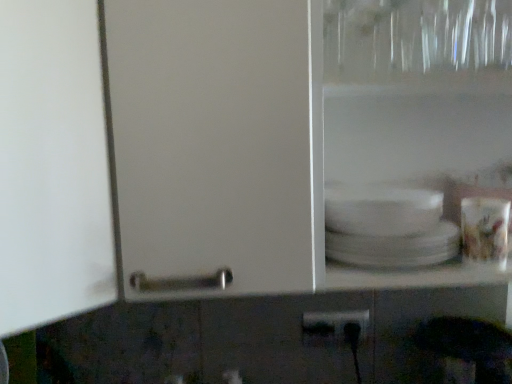
Describe the element at coordinates (335, 327) in the screenshot. Image resolution: width=512 pixels, height=384 pixels. I see `black plastic power plugs and sockets at lower center` at that location.

The image size is (512, 384). I want to click on black plastic power plugs and sockets at lower center, so click(335, 327).

In order to face black plastic power plugs and sockets at lower center, should I rotate leftwards or rightwards?

It's best to rotate right around 11.040 degrees.

What is the approximate height of matte ceramic cup at right?

matte ceramic cup at right is 4.34 inches tall.

What do you see at coordinates (485, 231) in the screenshot? I see `matte ceramic cup at right` at bounding box center [485, 231].

This screenshot has width=512, height=384. Identify the location of matte ceramic cup at right. (485, 231).

At what (x,y) coordinates should I click in order to perform the action: click on black plastic power plugs and sockets at lower center. Please return your answer as a coordinate pair (x, y). This screenshot has width=512, height=384. Looking at the image, I should click on (335, 327).

Considering the relative positions of black plastic power plugs and sockets at lower center and matte ceramic cup at right in the image provided, is black plastic power plugs and sockets at lower center to the right of matte ceramic cup at right from the viewer's perspective?

No, black plastic power plugs and sockets at lower center is not to the right of matte ceramic cup at right.

In the image, is black plastic power plugs and sockets at lower center positioned in front of or behind matte ceramic cup at right?

black plastic power plugs and sockets at lower center is behind matte ceramic cup at right.

Which is behind, point (311, 327) or point (490, 246)?

The point (311, 327) is more distant.

From the image's perspective, which is below, black plastic power plugs and sockets at lower center or matte ceramic cup at right?

black plastic power plugs and sockets at lower center is shown below in the image.

From a real-world perspective, which object stands above the other?

matte ceramic cup at right is physically above.

Which of these two, black plastic power plugs and sockets at lower center or matte ceramic cup at right, is wider?

matte ceramic cup at right is wider.

Can you confirm if black plastic power plugs and sockets at lower center is shorter than matte ceramic cup at right?

Indeed, black plastic power plugs and sockets at lower center has a lesser height compared to matte ceramic cup at right.

Which of these two, black plastic power plugs and sockets at lower center or matte ceramic cup at right, is smaller?

black plastic power plugs and sockets at lower center.

Can matte ceramic cup at right be found inside black plastic power plugs and sockets at lower center?

That's incorrect, matte ceramic cup at right is not inside black plastic power plugs and sockets at lower center.

Looking at this image, is there a large distance between black plastic power plugs and sockets at lower center and matte ceramic cup at right?

No, there isn't a large distance between black plastic power plugs and sockets at lower center and matte ceramic cup at right.

From the picture: Is black plastic power plugs and sockets at lower center facing away from matte ceramic cup at right?

That's not correct — black plastic power plugs and sockets at lower center is not looking away from matte ceramic cup at right.

What's the angular difference between black plastic power plugs and sockets at lower center and matte ceramic cup at right's facing directions?

The angular difference between black plastic power plugs and sockets at lower center and matte ceramic cup at right is 2 degrees.

You are a GUI agent. You are given a task and a screenshot of the screen. Output one action in this format:
    pyautogui.click(x=<x>, y=<y>)
    Task: Click on the tableware above the black plastic power plugs and sockets at lower center (from a real-world perspective)
    
    Given the screenshot: What is the action you would take?
    pyautogui.click(x=485, y=231)

Considering the positions of objects matte ceramic cup at right and black plastic power plugs and sockets at lower center in the image provided, who is more to the right, matte ceramic cup at right or black plastic power plugs and sockets at lower center?

Positioned to the right is matte ceramic cup at right.

Which object is closer to the camera, matte ceramic cup at right or black plastic power plugs and sockets at lower center?

matte ceramic cup at right is more forward.

Does point (499, 235) come farther from viewer compared to point (347, 337)?

No.

Consider the image. From the image's perspective, is matte ceramic cup at right positioned above or below black plastic power plugs and sockets at lower center?

Based on their image positions, matte ceramic cup at right is located above black plastic power plugs and sockets at lower center.

From a real-world perspective, is matte ceramic cup at right positioned above or below black plastic power plugs and sockets at lower center?

In terms of real-world spatial position, matte ceramic cup at right is above black plastic power plugs and sockets at lower center.

Between matte ceramic cup at right and black plastic power plugs and sockets at lower center, which one has larger width?

Wider between the two is matte ceramic cup at right.

Can you confirm if matte ceramic cup at right is taller than black plastic power plugs and sockets at lower center?

Yes, matte ceramic cup at right is taller than black plastic power plugs and sockets at lower center.

In the scene shown: Is matte ceramic cup at right smaller than black plastic power plugs and sockets at lower center?

Actually, matte ceramic cup at right might be larger than black plastic power plugs and sockets at lower center.

Could black plastic power plugs and sockets at lower center be considered to be inside matte ceramic cup at right?

No, black plastic power plugs and sockets at lower center is not surrounded by matte ceramic cup at right.

Is the surface of matte ceramic cup at right in direct contact with black plastic power plugs and sockets at lower center?

No, matte ceramic cup at right is not beside black plastic power plugs and sockets at lower center.

Is matte ceramic cup at right positioned with its back to black plastic power plugs and sockets at lower center?

No.

Could you measure the distance between matte ceramic cup at right and black plastic power plugs and sockets at lower center?

matte ceramic cup at right and black plastic power plugs and sockets at lower center are 14.64 inches apart.

You are a GUI agent. You are given a task and a screenshot of the screen. Output one action in this format:
    pyautogui.click(x=<x>, y=<y>)
    Task: Click on the power plugs and sockets that appears below the matte ceramic cup at right (from the image's perspective)
    
    Given the screenshot: What is the action you would take?
    pyautogui.click(x=335, y=327)

The width and height of the screenshot is (512, 384). In order to click on power plugs and sockets below the matte ceramic cup at right (from the image's perspective) in this screenshot , I will do `click(335, 327)`.

Where is `power plugs and sockets on the left of matte ceramic cup at right`? Image resolution: width=512 pixels, height=384 pixels. power plugs and sockets on the left of matte ceramic cup at right is located at coordinates (335, 327).